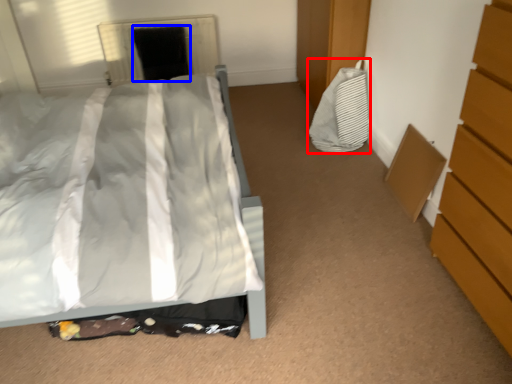
Question: Which object is further to the camera taking this photo, material (highlighted by a red box) or screen door (highlighted by a blue box)?

Choices:
 (A) material
 (B) screen door

Answer: (B)